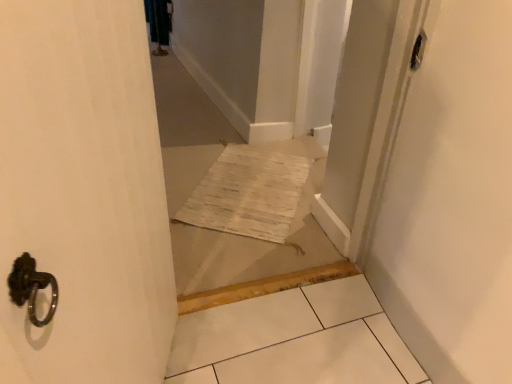
What do you see at coordinates (360, 120) in the screenshot? I see `transparent plastic screen door at upper right` at bounding box center [360, 120].

Locate an element on the screen. Image resolution: width=512 pixels, height=384 pixels. transparent plastic screen door at upper right is located at coordinates (360, 120).

Measure the distance between white woven mat at center and camera.

white woven mat at center is 5.46 feet from camera.

The image size is (512, 384). Describe the element at coordinates (257, 250) in the screenshot. I see `white woven mat at center` at that location.

You are a GUI agent. You are given a task and a screenshot of the screen. Output one action in this format:
    pyautogui.click(x=<x>, y=<y>)
    Task: Click on the white woven mat at center
    The width and height of the screenshot is (512, 384).
    Given the screenshot: What is the action you would take?
    pyautogui.click(x=257, y=250)

Where is `transparent plastic screen door at upper right`? The height and width of the screenshot is (384, 512). transparent plastic screen door at upper right is located at coordinates (360, 120).

Does white woven mat at center appear on the right side of transparent plastic screen door at upper right?

No.

Is white woven mat at center closer to camera compared to transparent plastic screen door at upper right?

Yes, it is in front of transparent plastic screen door at upper right.

Which is less distant, (188, 83) or (391, 16)?

Point (391, 16)

From the image's perspective, does white woven mat at center appear lower than transparent plastic screen door at upper right?

Incorrect, from the image's perspective, white woven mat at center is higher than transparent plastic screen door at upper right.

From a real-world perspective, is white woven mat at center beneath transparent plastic screen door at upper right?

Yes, from a real-world perspective, white woven mat at center is beneath transparent plastic screen door at upper right.

Can you confirm if white woven mat at center is wider than transparent plastic screen door at upper right?

Yes, white woven mat at center is wider than transparent plastic screen door at upper right.

Between white woven mat at center and transparent plastic screen door at upper right, which one has less height?

Standing shorter between the two is white woven mat at center.

In terms of size, does white woven mat at center appear bigger or smaller than transparent plastic screen door at upper right?

Considering their sizes, white woven mat at center takes up more space than transparent plastic screen door at upper right.

Consider the image. Could transparent plastic screen door at upper right be considered to be inside white woven mat at center?

No, transparent plastic screen door at upper right is not surrounded by white woven mat at center.

Based on the photo, is white woven mat at center positioned far away from transparent plastic screen door at upper right?

No, white woven mat at center is in close proximity to transparent plastic screen door at upper right.

Could you tell me if white woven mat at center is turned towards transparent plastic screen door at upper right?

No, white woven mat at center does not turn towards transparent plastic screen door at upper right.

Can you tell me how much white woven mat at center and transparent plastic screen door at upper right differ in facing direction?

89.2 degrees.

The height and width of the screenshot is (384, 512). What are the coordinates of `screen door above the white woven mat at center (from a real-world perspective)` in the screenshot? It's located at (360, 120).

Is transparent plastic screen door at upper right to the right of white woven mat at center from the viewer's perspective?

Yes.

In the scene shown: Is the position of transparent plastic screen door at upper right less distant than that of white woven mat at center?

No, it is not.

Is point (400, 21) in front of point (234, 253)?

Yes, it is in front of point (234, 253).

From the image's perspective, is transparent plastic screen door at upper right above white woven mat at center?

No, from the image's perspective, transparent plastic screen door at upper right is not above white woven mat at center.

From a real-world perspective, who is located higher, transparent plastic screen door at upper right or white woven mat at center?

From a 3D spatial view, transparent plastic screen door at upper right is above.

Considering the sizes of transparent plastic screen door at upper right and white woven mat at center in the image, is transparent plastic screen door at upper right wider or thinner than white woven mat at center?

In the image, transparent plastic screen door at upper right appears to be more narrow than white woven mat at center.

Between transparent plastic screen door at upper right and white woven mat at center, which one has more height?

transparent plastic screen door at upper right is taller.

Is transparent plastic screen door at upper right bigger or smaller than white woven mat at center?

Clearly, transparent plastic screen door at upper right is smaller in size than white woven mat at center.

Is white woven mat at center completely or partially inside transparent plastic screen door at upper right?

No, white woven mat at center is not a part of transparent plastic screen door at upper right.

Is transparent plastic screen door at upper right in contact with white woven mat at center?

There is a gap between transparent plastic screen door at upper right and white woven mat at center.

Is transparent plastic screen door at upper right facing towards white woven mat at center?

No, transparent plastic screen door at upper right is not facing towards white woven mat at center.

This screenshot has width=512, height=384. I want to click on screen door that appears on the right of white woven mat at center, so click(360, 120).

Where is `corridor in front of the transparent plastic screen door at upper right`? corridor in front of the transparent plastic screen door at upper right is located at coordinates (257, 250).

At what (x,y) coordinates should I click in order to perform the action: click on screen door on the right of white woven mat at center. Please return your answer as a coordinate pair (x, y). Image resolution: width=512 pixels, height=384 pixels. Looking at the image, I should click on (360, 120).